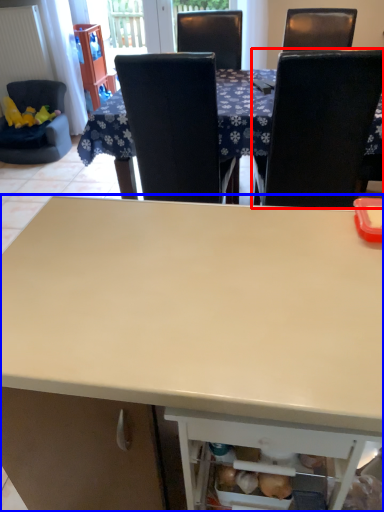
Question: Which point is further to the camera, chair (highlighted by a red box) or desk (highlighted by a blue box)?

Choices:
 (A) chair
 (B) desk

Answer: (A)